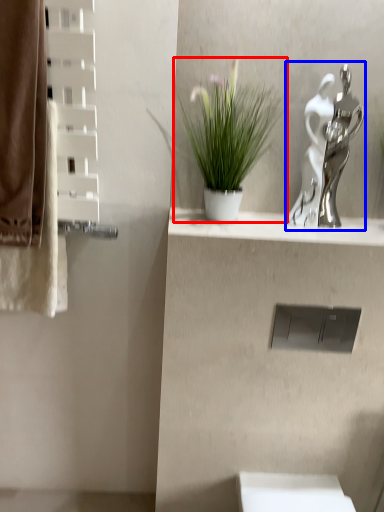
Question: Which of the following is the farthest to the observer, houseplant (highlighted by a red box) or sculpture (highlighted by a blue box)?

Choices:
 (A) houseplant
 (B) sculpture

Answer: (B)